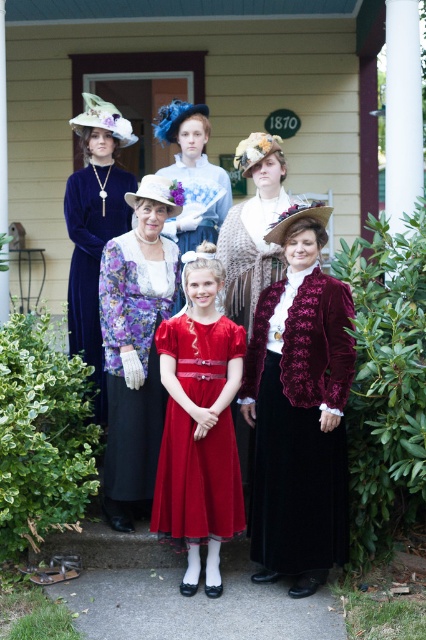
Question: Which point is closer to the camera?

Choices:
 (A) (199, 230)
 (B) (307, 397)
 (C) (155, 445)

Answer: (B)

Question: In this image, where is velvet floral dress at center located relative to shiny red dress at center?

Choices:
 (A) left
 (B) right

Answer: (A)

Question: Among these points, which one is farthest from the camera?

Choices:
 (A) (307, 224)
 (B) (167, 488)

Answer: (A)

Question: Considering the real-world distances, which object is farthest from the shiny red dress at center?

Choices:
 (A) velvet red dress at center
 (B) velvet floral dress at center
 (C) velvet burgundy dress at center

Answer: (C)

Question: From the image, what is the correct spatial relationship of shiny red dress at center in relation to velvet dress at center?

Choices:
 (A) left
 (B) right

Answer: (B)

Question: Does velvet maroon jacket at center have a greater width compared to shiny red dress at center?

Choices:
 (A) yes
 (B) no

Answer: (A)